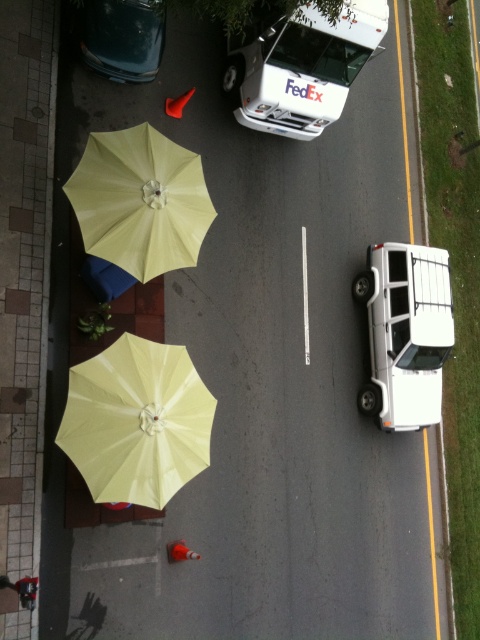
Who is positioned more to the right, yellow fabric umbrella at lower left or white matte fedex van at upper center?

Positioned to the right is white matte fedex van at upper center.

What do you see at coordinates (136, 420) in the screenshot? This screenshot has width=480, height=640. I see `yellow fabric umbrella at lower left` at bounding box center [136, 420].

Where is `yellow fabric umbrella at lower left`? yellow fabric umbrella at lower left is located at coordinates (136, 420).

Does yellow fabric umbrella at lower left have a smaller size compared to metallic blue car at upper left?

No.

Between yellow fabric umbrella at lower left and metallic blue car at upper left, which one appears on the right side from the viewer's perspective?

From the viewer's perspective, yellow fabric umbrella at lower left appears more on the right side.

In order to click on yellow fabric umbrella at lower left in this screenshot , I will do `click(136, 420)`.

Does yellow fabric umbrella at lower left have a greater width compared to yellow matte umbrella at upper left?

No.

Does yellow fabric umbrella at lower left have a greater height compared to yellow matte umbrella at upper left?

In fact, yellow fabric umbrella at lower left may be shorter than yellow matte umbrella at upper left.

Does point (97, 422) come farther from viewer compared to point (137, 184)?

No.

You are a GUI agent. You are given a task and a screenshot of the screen. Output one action in this format:
    pyautogui.click(x=<x>, y=<y>)
    Task: Click on the yellow fabric umbrella at lower left
    The width and height of the screenshot is (480, 640).
    Given the screenshot: What is the action you would take?
    pyautogui.click(x=136, y=420)